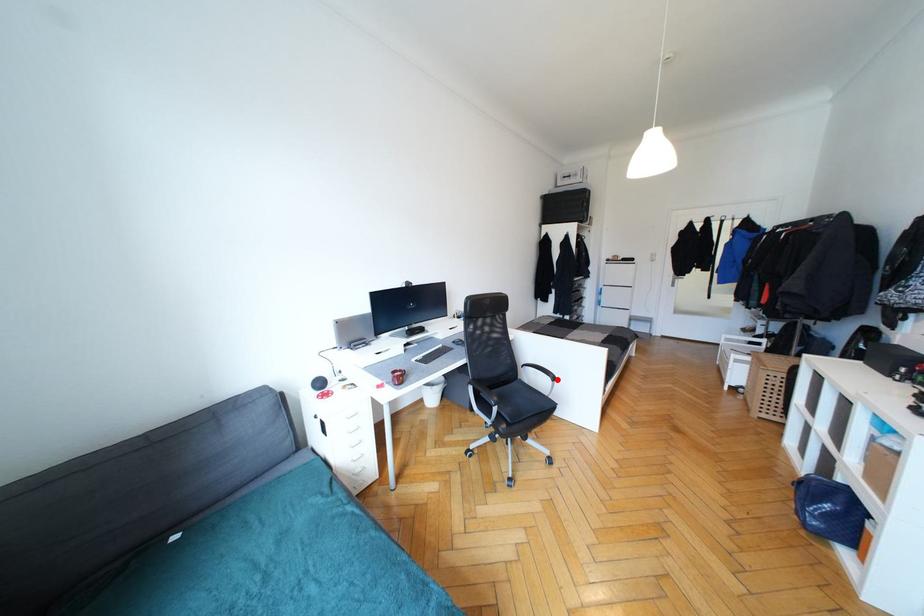
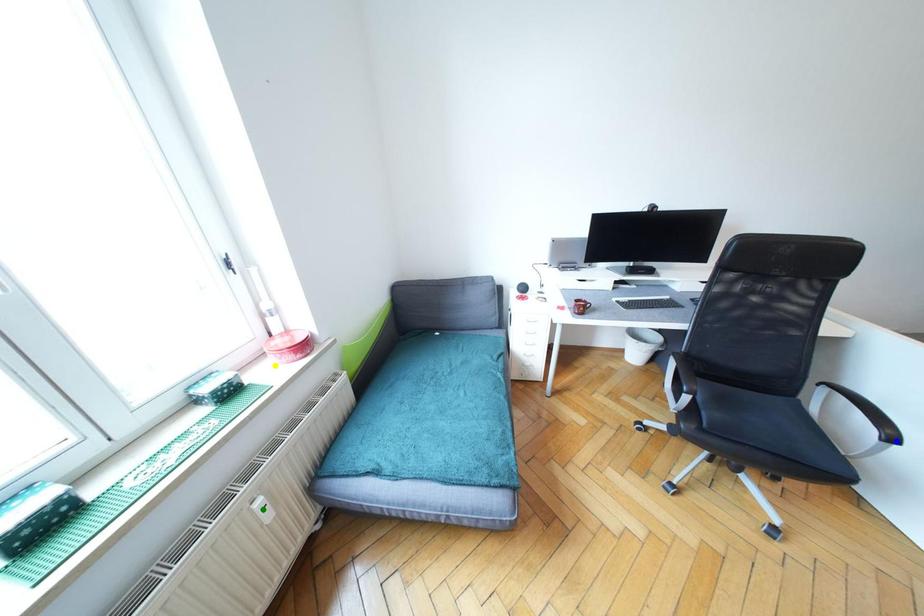
Question: I am providing you with two images of the same scene from different viewpoints. A red point is marked on the first image. You are given multiple points on the second image. Can you choose the point in image 2 that corresponds to the point in image 1?

Choices:
 (A) green point
 (B) yellow point
 (C) blue point

Answer: (C)